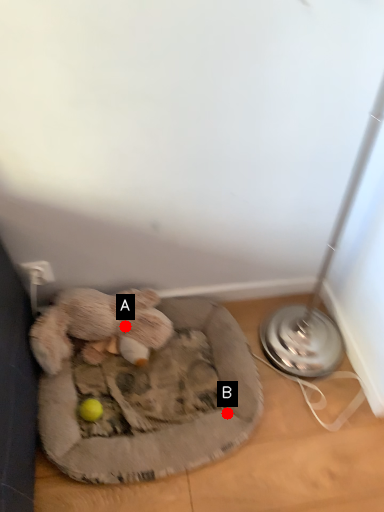
Question: Two points are circled on the image, labeled by A and B beside each circle. Which point is further to the camera?

Choices:
 (A) A is further
 (B) B is further

Answer: (A)